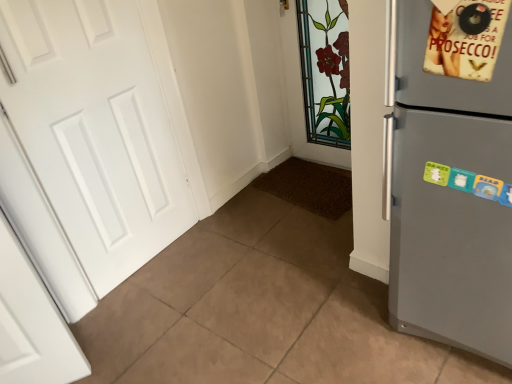
Question: From the image's perspective, is satin grey fridge at right above or below beige paper poster at upper right?

Choices:
 (A) above
 (B) below

Answer: (B)

Question: In terms of width, does satin grey fridge at right look wider or thinner when compared to beige paper poster at upper right?

Choices:
 (A) wide
 (B) thin

Answer: (A)

Question: Considering the real-world distances, which object is closest to the beige paper poster at upper right?

Choices:
 (A) satin grey fridge at right
 (B) white matte door at left

Answer: (A)

Question: Estimate the real-world distances between objects in this image. Which object is closer to the beige paper poster at upper right?

Choices:
 (A) satin grey fridge at right
 (B) white matte door at left

Answer: (A)